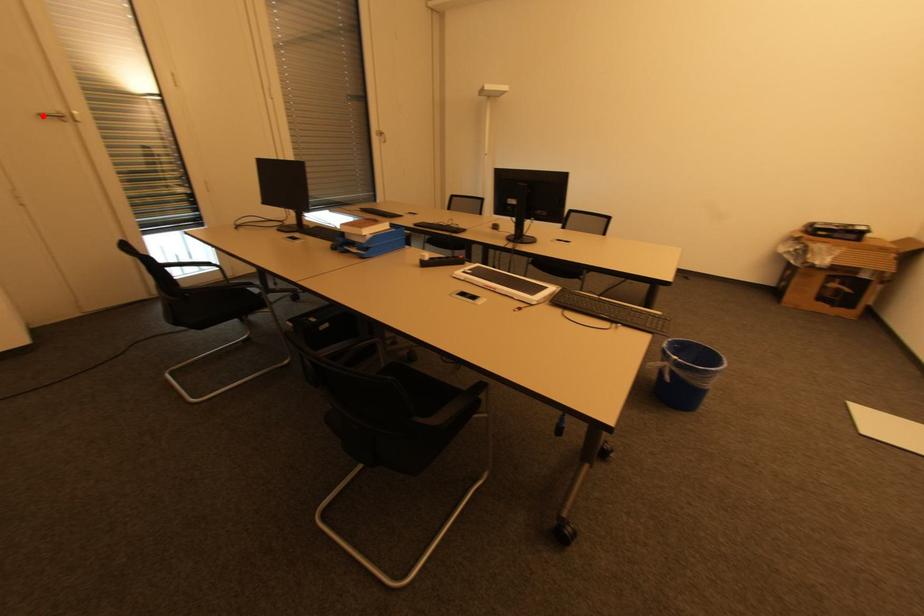
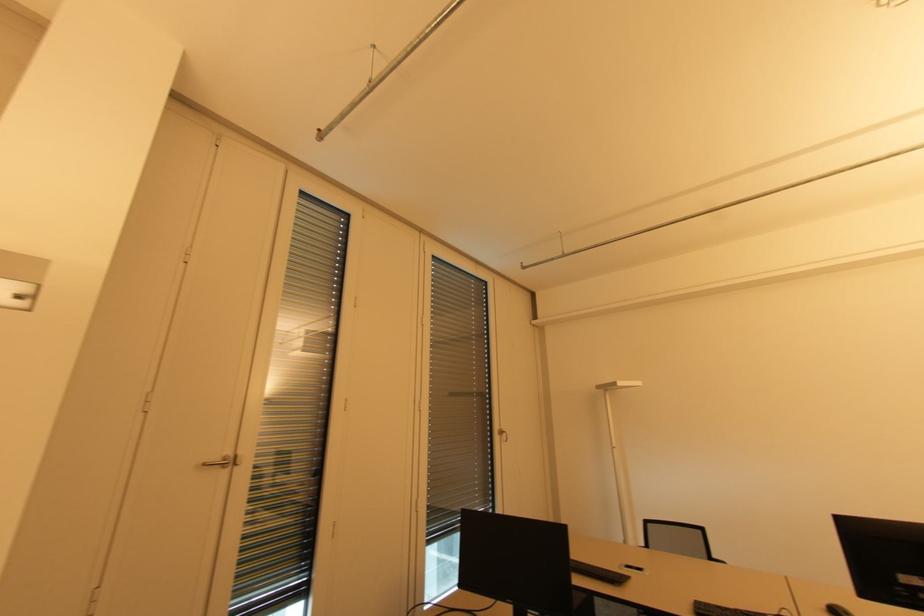
Question: A red point is marked in image1. In image2, is the corresponding 3D point closer to the camera or farther? Reply with the corresponding letter.

Choices:
 (A) The corresponding 3D point is closer.
 (B) The corresponding 3D point is farther.

Answer: (A)